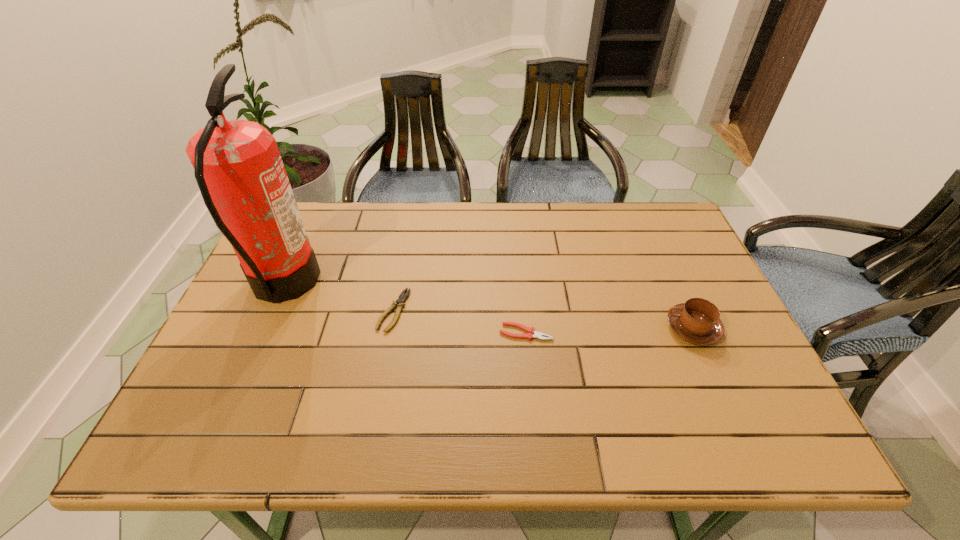
At what (x,y) coordinates should I click in order to perform the action: click on fire extinguisher. Please return your answer as a coordinate pair (x, y). Looking at the image, I should click on (237, 164).

Where is `the leftmost object`? the leftmost object is located at coordinates (237, 164).

Find the location of a particular element. This screenshot has width=960, height=540. the rightmost object is located at coordinates (697, 321).

Locate an element on the screen. Image resolution: width=960 pixels, height=540 pixels. the third shortest object is located at coordinates (697, 321).

Identify the location of the second object from left to right. (399, 303).

Identify the location of the second object from right to left. This screenshot has width=960, height=540. (539, 335).

Locate an element on the screen. This screenshot has width=960, height=540. vacant region located 0.250m on the front side of the leftmost object is located at coordinates (407, 284).

This screenshot has height=540, width=960. In order to click on vacant space located 0.190m on the side of the rightmost object with the handle in this screenshot , I will do `click(589, 328)`.

Identify the location of blank space located on the side of the rightmost object with the handle. (642, 328).

The width and height of the screenshot is (960, 540). In order to click on free point located 0.360m on the side of the rightmost object with the handle in this screenshot , I will do `click(521, 328)`.